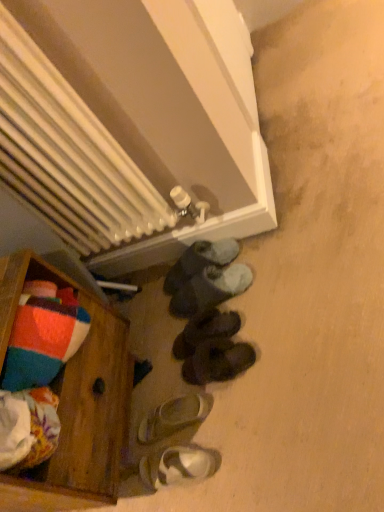
This screenshot has width=384, height=512. In order to click on spots to the right of dark gray suede slippers at lower center, which is the 5th footwear from bottom to top in this screenshot , I will do `click(267, 258)`.